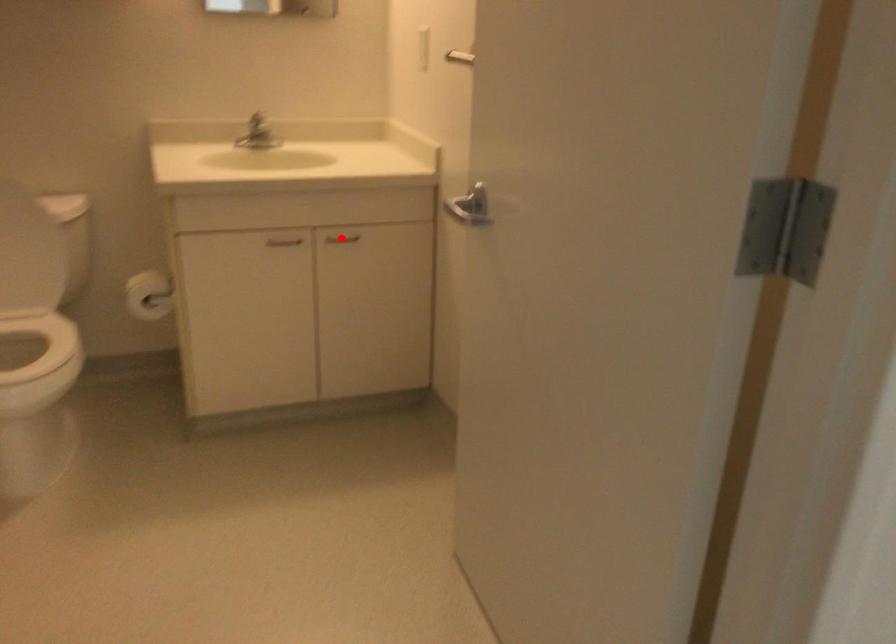
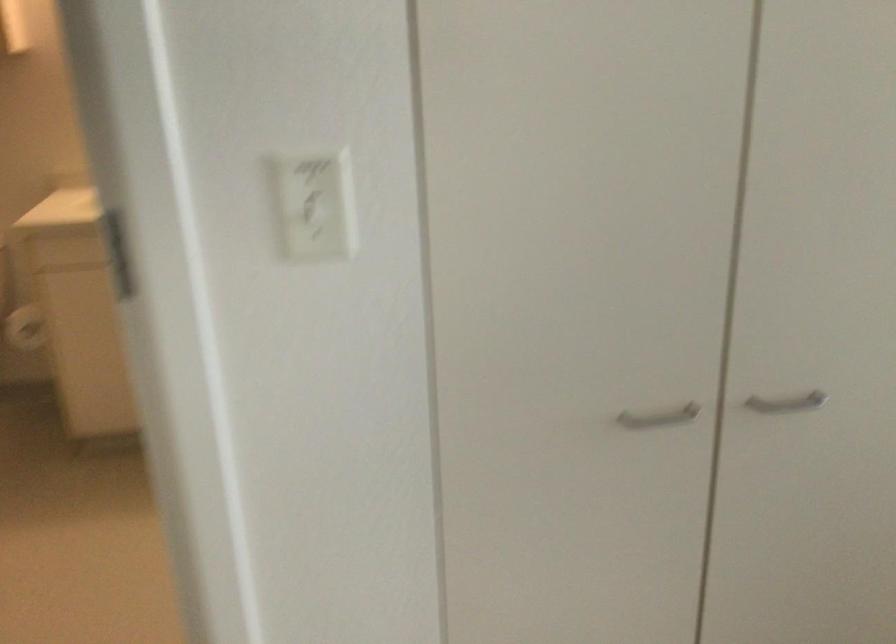
Question: I am providing you with two images of the same scene from different viewpoints. A red point is marked on the first image. At the location where the point appears in image 1, is it still visible in image 2?

Choices:
 (A) Yes
 (B) No

Answer: (B)